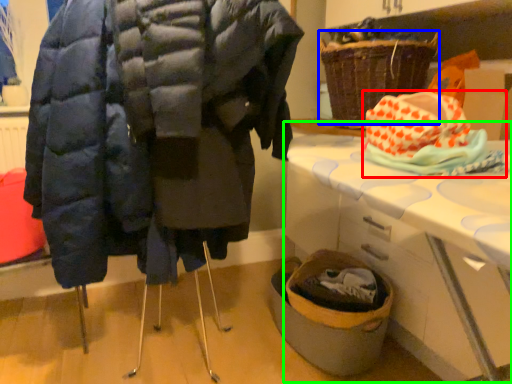
Question: Estimate the real-world distances between objects in this image. Which object is closer to material (highlighted by a red box), basket (highlighted by a blue box) or table (highlighted by a green box)?

Choices:
 (A) basket
 (B) table

Answer: (B)